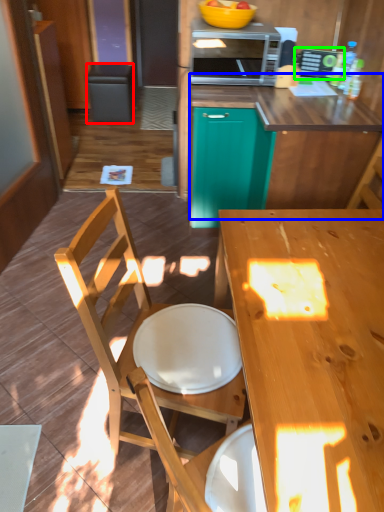
Question: Which is nearer to the trash bin/can (highlighted by a red box)? counter (highlighted by a blue box) or appliance (highlighted by a green box).

Choices:
 (A) counter
 (B) appliance

Answer: (B)